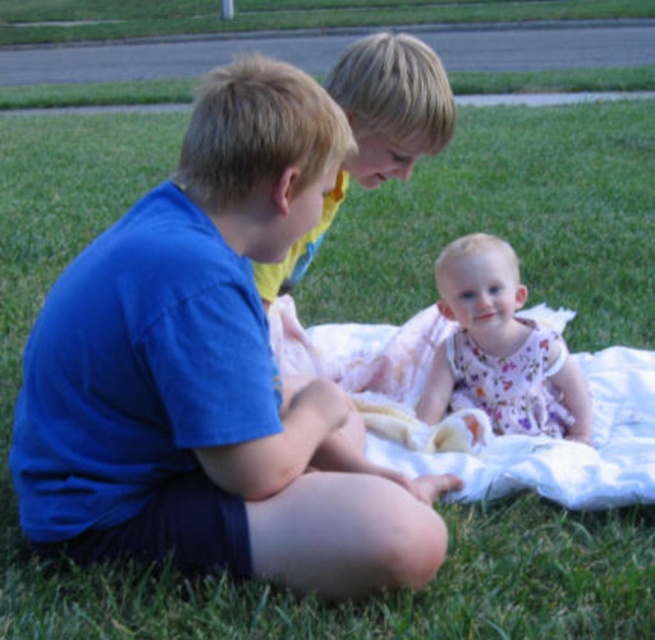
Based on the scene, which object has a smaller height between the white cotton blanket at center and the smooth blonde hair at center?

The white cotton blanket at center has a lesser height compared to the smooth blonde hair at center.

Based on the scene description, which object is shorter between the floral dress at center and the smooth blonde hair at center?

The floral dress at center is shorter than the smooth blonde hair at center.

From the picture: Based on the scene description, which object is positioned behind the other between the floral dress at center and the smooth blonde hair at center?

The smooth blonde hair at center is positioned behind the floral dress at center.